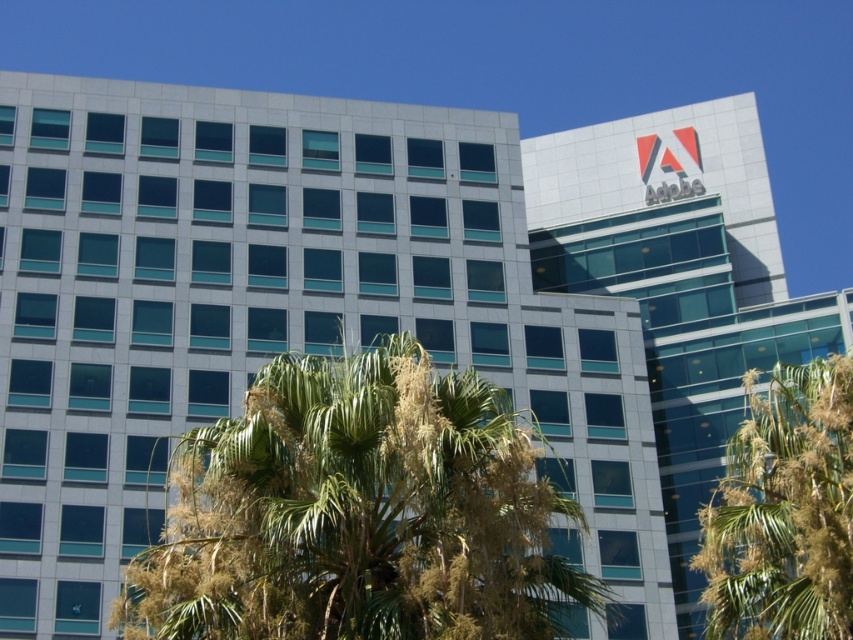
Question: Which object appears farthest from the camera in this image?

Choices:
 (A) green leafy tree at lower right
 (B) green leafy palm tree at center

Answer: (A)

Question: Is green leafy palm tree at center positioned before green leafy tree at lower right?

Choices:
 (A) yes
 (B) no

Answer: (A)

Question: Is green leafy palm tree at center behind green leafy tree at lower right?

Choices:
 (A) no
 (B) yes

Answer: (A)

Question: Can you confirm if green leafy palm tree at center is positioned to the right of green leafy tree at lower right?

Choices:
 (A) yes
 (B) no

Answer: (B)

Question: Which point is farther to the camera?

Choices:
 (A) green leafy tree at lower right
 (B) green leafy palm tree at center

Answer: (A)

Question: Among these objects, which one is farthest from the camera?

Choices:
 (A) green leafy tree at lower right
 (B) green leafy palm tree at center

Answer: (A)